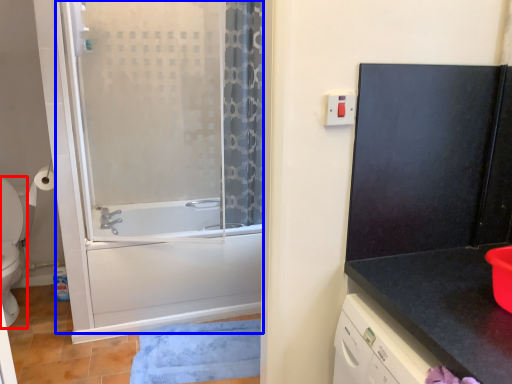
Question: Among these objects, which one is farthest to the camera, toilet (highlighted by a red box) or screen door (highlighted by a blue box)?

Choices:
 (A) toilet
 (B) screen door

Answer: (A)